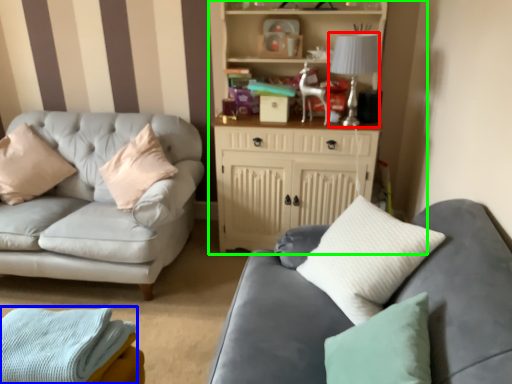
Question: Based on their relative distances, which object is farther from lamp (highlighted by a red box)? Choose from material (highlighted by a blue box) and entertainment center (highlighted by a green box).

Choices:
 (A) material
 (B) entertainment center

Answer: (A)